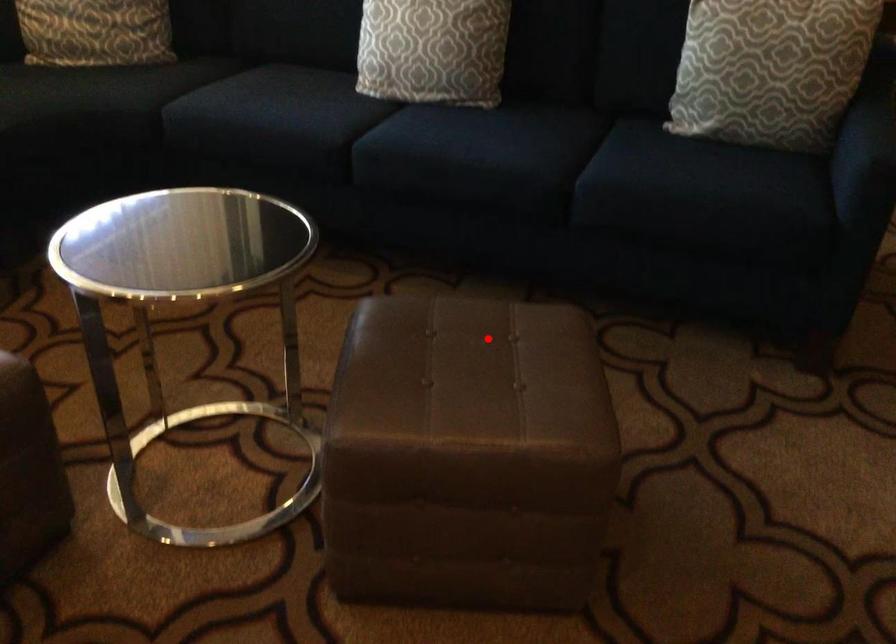
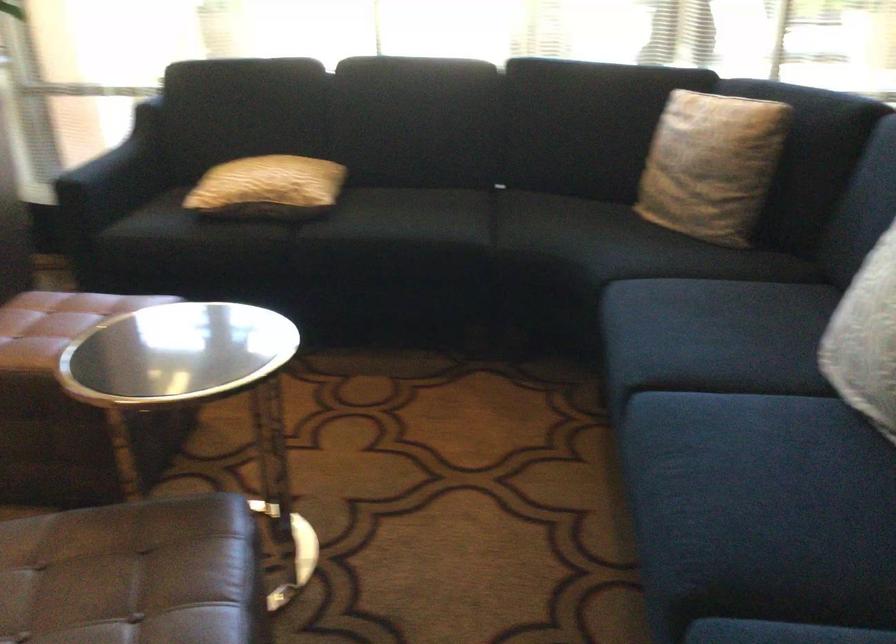
Locate, in the second image, the point that corresponds to the highlighted location in the first image.

(134, 574)